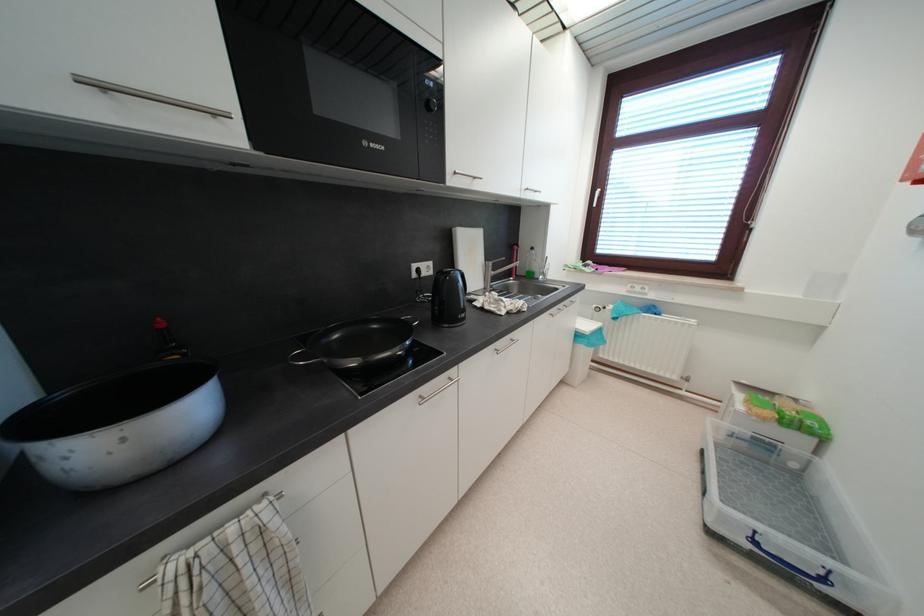
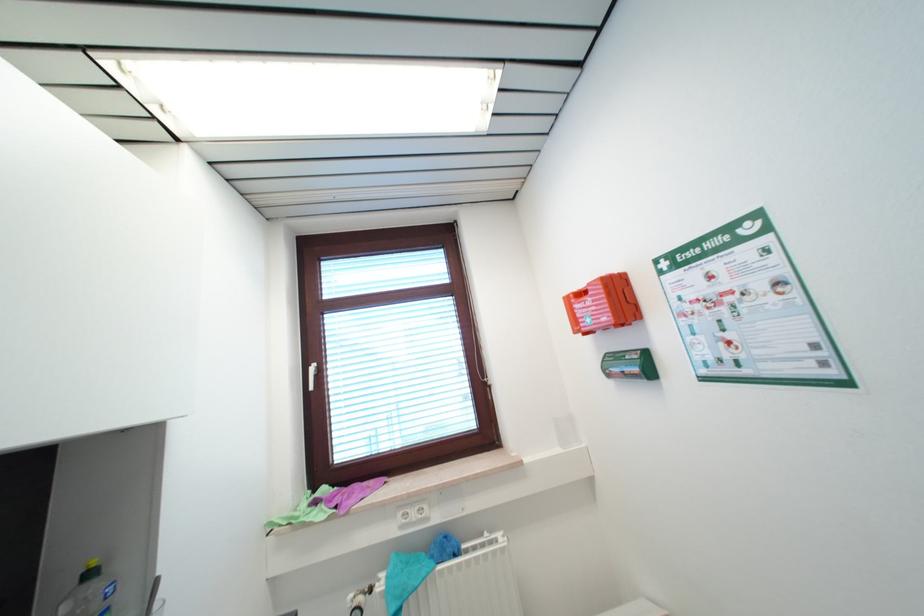
Locate, in the second image, the point that corresponds to [572,268] in the first image.

(274, 525)